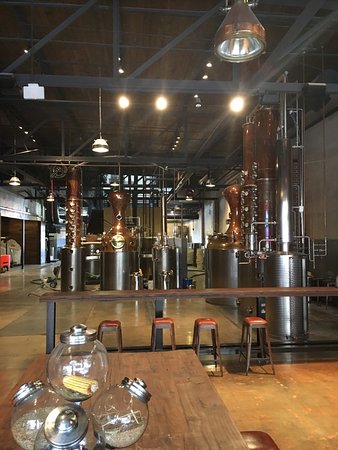
Image resolution: width=338 pixels, height=450 pixels. I want to click on counter, so click(x=155, y=292).